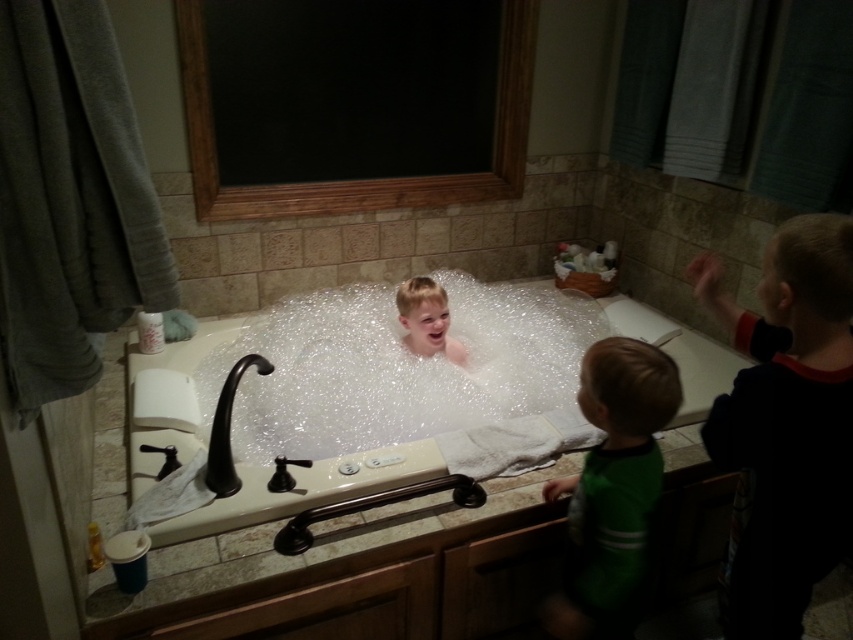
You are a parent trying to locate your child in the bathroom. You see the black cotton shirt at upper right and the translucent plastic boy at center. Which object is nearer to you?

The black cotton shirt at upper right is closer to the viewer than the translucent plastic boy at center.

You are a parent trying to clean the bathroom. You need to move the black cotton shirt at upper right to make space for a new cleaning spray. Since the clear bubble foam at center is taking up a lot of space, can you move it out of the way?

The clear bubble foam at center is larger in size than the black cotton shirt at upper right, so it might be more challenging to move it out of the way due to its size.